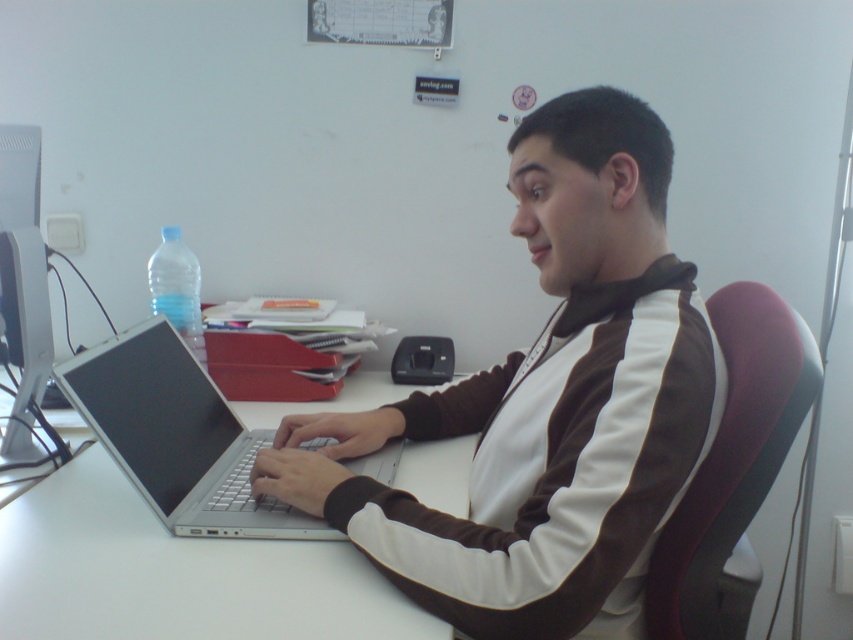
Question: Which object is the farthest from the transparent plastic bottle at left?

Choices:
 (A) silver metallic laptop at center
 (B) white glossy table at center

Answer: (B)

Question: Which of the following is the farthest from the observer?

Choices:
 (A) (599, 432)
 (B) (160, 252)
 (C) (378, 456)

Answer: (B)

Question: Is the position of silver metallic laptop at center less distant than that of transparent plastic bottle at left?

Choices:
 (A) no
 (B) yes

Answer: (B)

Question: Which point is farther to the camera?

Choices:
 (A) white glossy table at center
 (B) white smooth jacket at center
 (C) silver metallic laptop at center

Answer: (C)

Question: Can you confirm if white smooth jacket at center is bigger than transparent plastic bottle at left?

Choices:
 (A) no
 (B) yes

Answer: (B)

Question: Is silver metallic laptop at center in front of transparent plastic bottle at left?

Choices:
 (A) no
 (B) yes

Answer: (B)